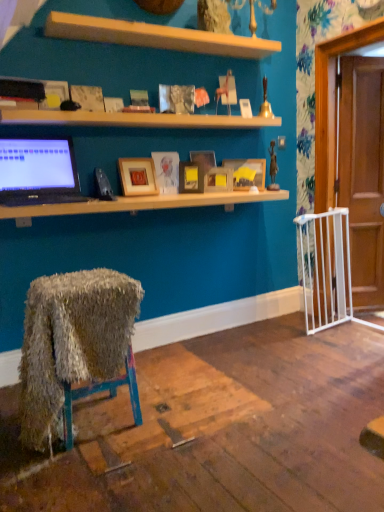
Question: Choose the correct answer: Is matte wooden picture frame at center, the sixth picture frame when ordered from left to right, inside matte gold picture frame at center, acting as the 4th picture frame starting from the right, or outside it?

Choices:
 (A) inside
 (B) outside

Answer: (B)

Question: Considering the positions of matte wooden picture frame at center, the first picture frame positioned from the right, and matte gold picture frame at center, the 3th picture frame when ordered from left to right, in the image, is matte wooden picture frame at center, the first picture frame positioned from the right, taller or shorter than matte gold picture frame at center, the 3th picture frame when ordered from left to right,?

Choices:
 (A) tall
 (B) short

Answer: (A)

Question: Considering the real-world distances, which object is closest to the matte wooden picture frame at center, the third picture frame in the right-to-left sequence?

Choices:
 (A) white plastic gate at right
 (B) matte wooden picture frame at center, the first picture frame positioned from the right
 (C) matte gold picture frame at center, the 3th picture frame when ordered from left to right
 (D) fuzzy fabric chair at lower left, which is the 2th desk in top-to-bottom order
 (E) matte wooden picture frame at center, which appears as the fifth picture frame when viewed from the right

Answer: (C)

Question: Estimate the real-world distances between objects in this image. Which object is farther from the matte wooden picture frame at center, the third picture frame in the right-to-left sequence?

Choices:
 (A) wooden at upper center, acting as the 1th shelf starting from the top
 (B) wooden picture frame at center, the 6th picture frame from the right
 (C) matte wooden picture frame at center, which appears as the fifth picture frame when viewed from the right
 (D) white plastic gate at right
 (E) matte wooden picture frame at center, which ranks as the second picture frame in right-to-left order

Answer: (D)